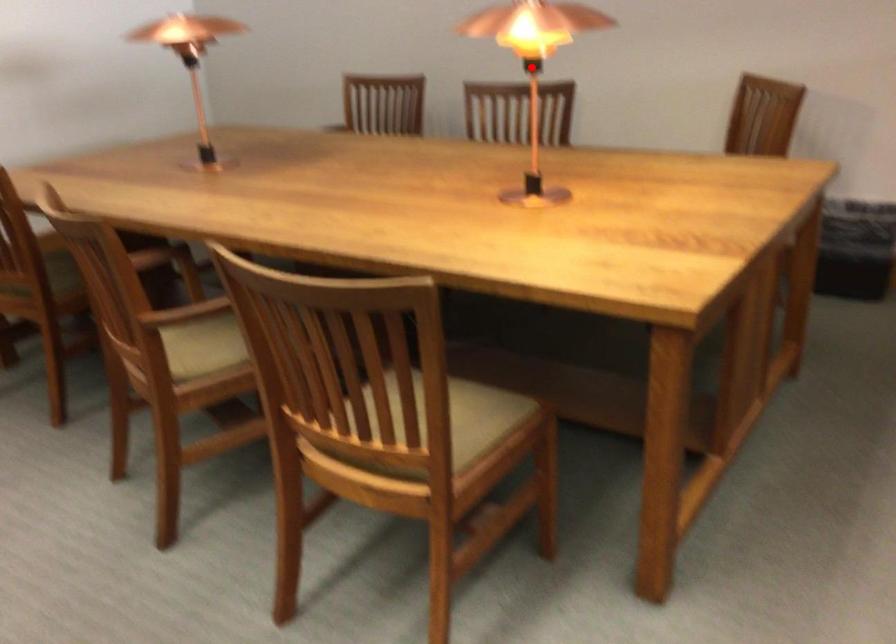
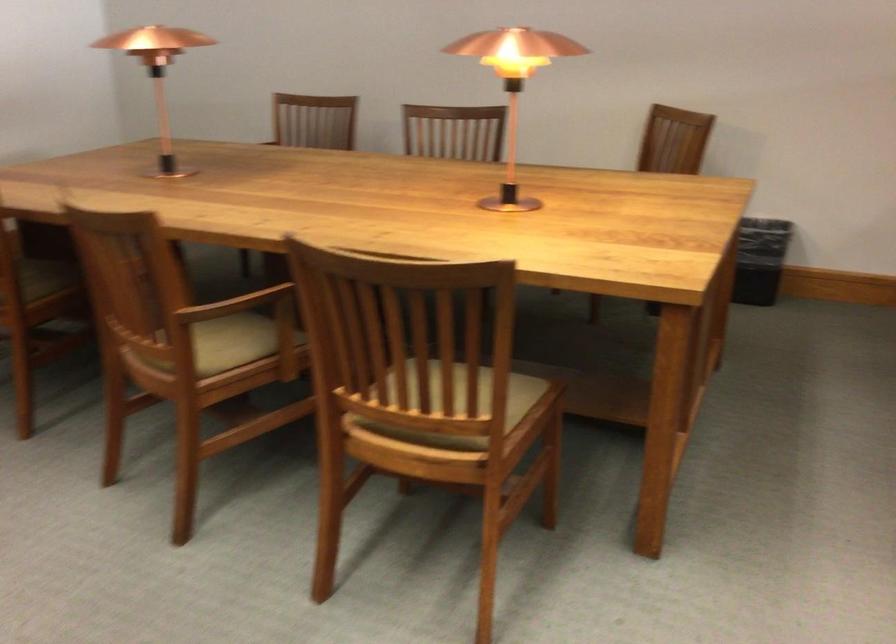
Question: I am providing you with two images of the same scene from different viewpoints. A red point is marked on the first image. Is the red point's position out of view in image 2?

Choices:
 (A) Yes
 (B) No

Answer: (B)